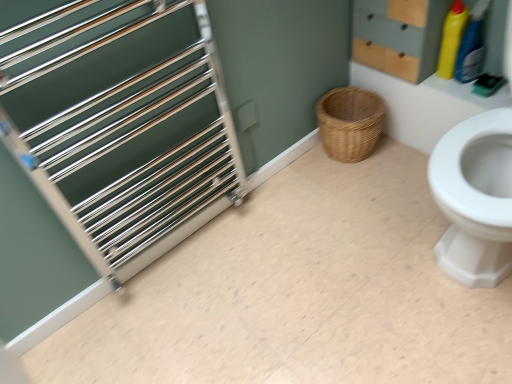
The image size is (512, 384). What are the coordinates of `vacant space that is to the left of woven natural basket at lower center` in the screenshot? It's located at tap(308, 175).